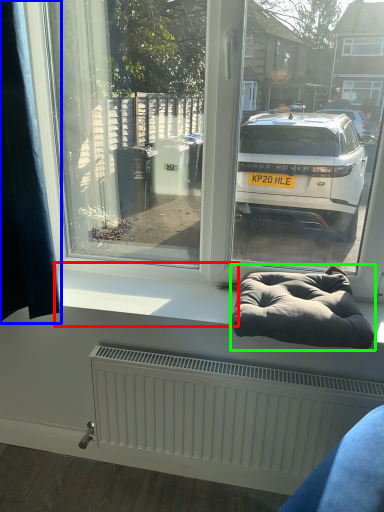
Question: Considering the real-world distances, which object is closest to window sill (highlighted by a red box)? curtain (highlighted by a blue box) or bean bag chair (highlighted by a green box).

Choices:
 (A) curtain
 (B) bean bag chair

Answer: (B)